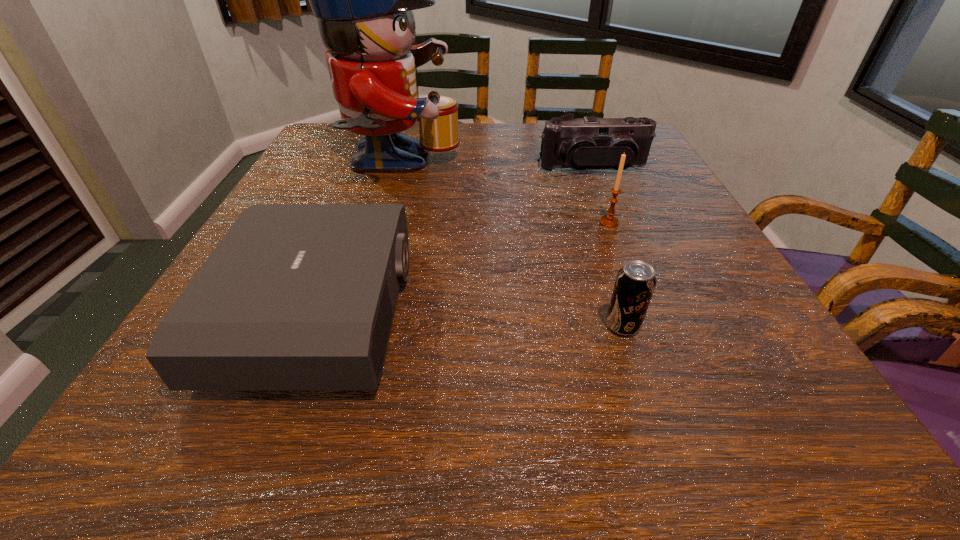
You are a GUI agent. You are given a task and a screenshot of the screen. Output one action in this format:
    pyautogui.click(x=<x>, y=<y>)
    Task: Click on the vacant space that's between the candle_holder and the soda can
    
    Given the screenshot: What is the action you would take?
    pyautogui.click(x=616, y=274)

Where is `free spot between the camcorder and the fourth shortest object`? Image resolution: width=960 pixels, height=540 pixels. free spot between the camcorder and the fourth shortest object is located at coordinates 601,195.

Where is `free space that is in between the fourth shortest object and the projector`? free space that is in between the fourth shortest object and the projector is located at coordinates (464, 267).

This screenshot has height=540, width=960. I want to click on empty space between the projector and the camcorder, so click(x=456, y=240).

This screenshot has height=540, width=960. In order to click on object that stands as the third closest to the soda can in this screenshot , I will do `click(363, 0)`.

Locate an element on the screen. object that stands as the closest to the nutcracker is located at coordinates (295, 296).

The height and width of the screenshot is (540, 960). I want to click on free space that satisfies the following two spatial constraints: 1. on the front-facing side of the soda can; 2. on the right side of the projector, so click(x=313, y=326).

In order to click on vacant point that satisfies the following two spatial constraints: 1. on the front-facing side of the tallest object; 2. on the back side of the soda can in this screenshot , I will do `click(350, 326)`.

Identify the location of free space that satisfies the following two spatial constraints: 1. on the front-facing side of the camcorder; 2. on the front-facing side of the projector. (651, 312).

The image size is (960, 540). What are the coordinates of `vacant region that satisfies the following two spatial constraints: 1. on the front-facing side of the tallest object; 2. on the left side of the soda can` in the screenshot? It's located at (350, 326).